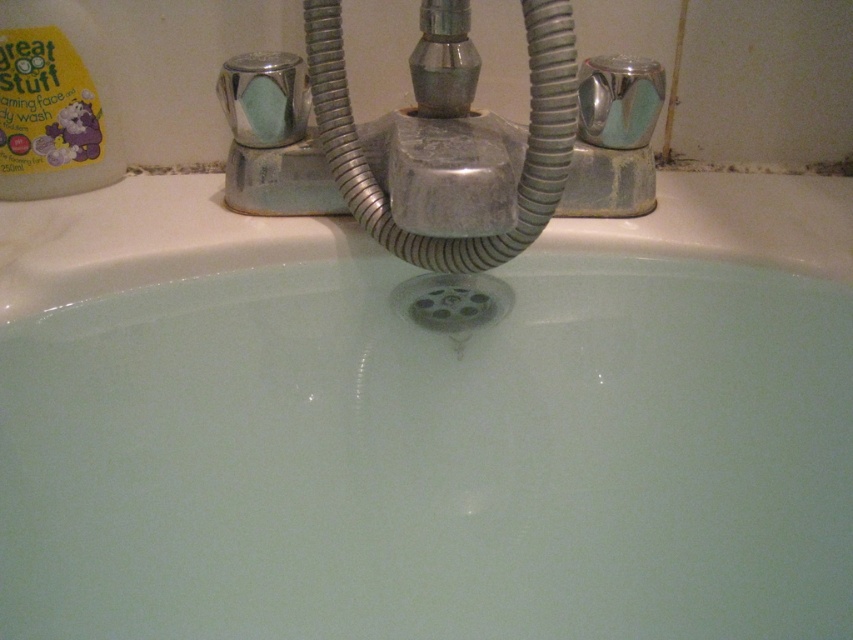
The height and width of the screenshot is (640, 853). What do you see at coordinates (440, 413) in the screenshot? I see `white glossy bath at center` at bounding box center [440, 413].

Which of these two, white glossy bath at center or matte green soap at upper center, stands taller?

With more height is white glossy bath at center.

Is point (759, 305) closer to camera compared to point (283, 124)?

Yes, it is in front of point (283, 124).

I want to click on white glossy bath at center, so click(x=440, y=413).

Does chrome/metallic faucet at center appear under matte green soap at upper center?

Correct, chrome/metallic faucet at center is located below matte green soap at upper center.

Can you confirm if chrome/metallic faucet at center is positioned to the right of matte green soap at upper center?

Indeed, chrome/metallic faucet at center is positioned on the right side of matte green soap at upper center.

This screenshot has height=640, width=853. What are the coordinates of `chrome/metallic faucet at center` in the screenshot? It's located at (447, 140).

Is white glossy bath at center to the right of chrome/metallic faucet at center from the viewer's perspective?

Correct, you'll find white glossy bath at center to the right of chrome/metallic faucet at center.

The width and height of the screenshot is (853, 640). Identify the location of white glossy bath at center. (440, 413).